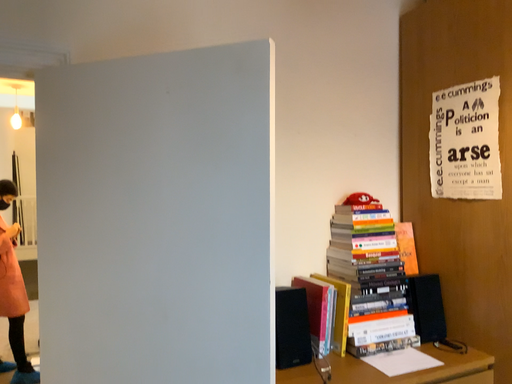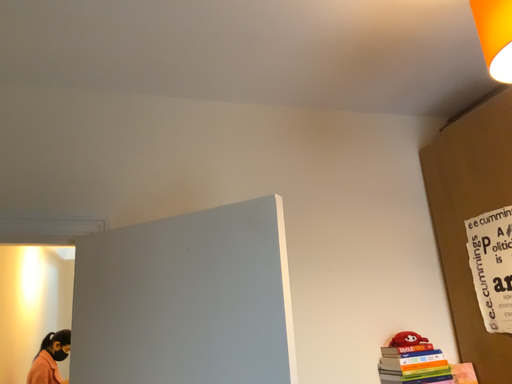
Question: Which way did the camera rotate in the video?

Choices:
 (A) rotated right
 (B) rotated left

Answer: (B)